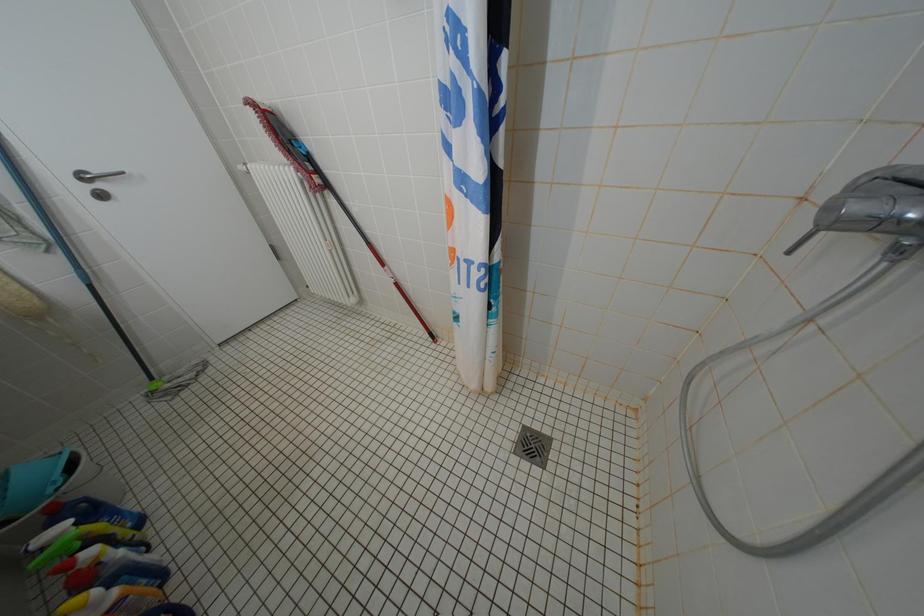
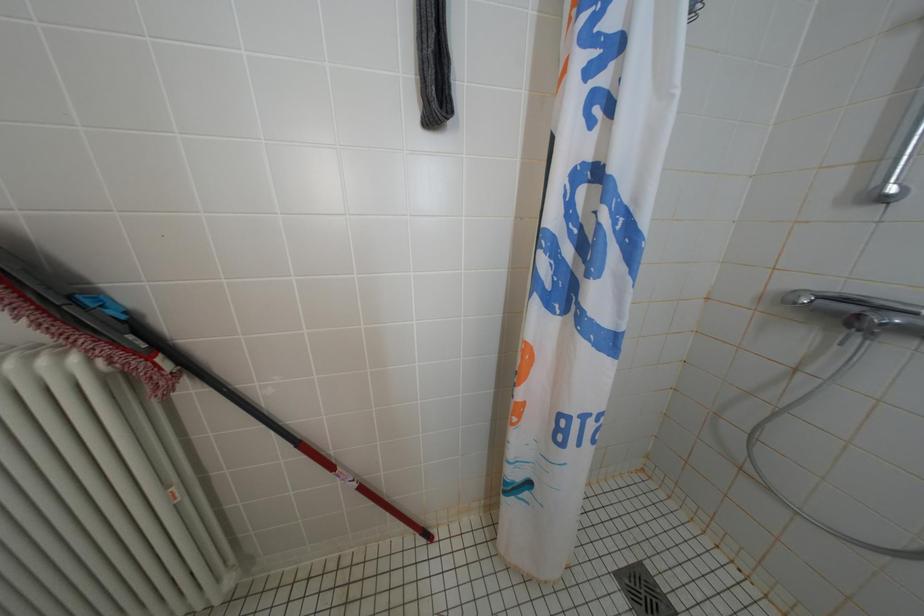
Question: How did the camera likely rotate?

Choices:
 (A) Left
 (B) Right
 (C) Up
 (D) Down

Answer: (B)